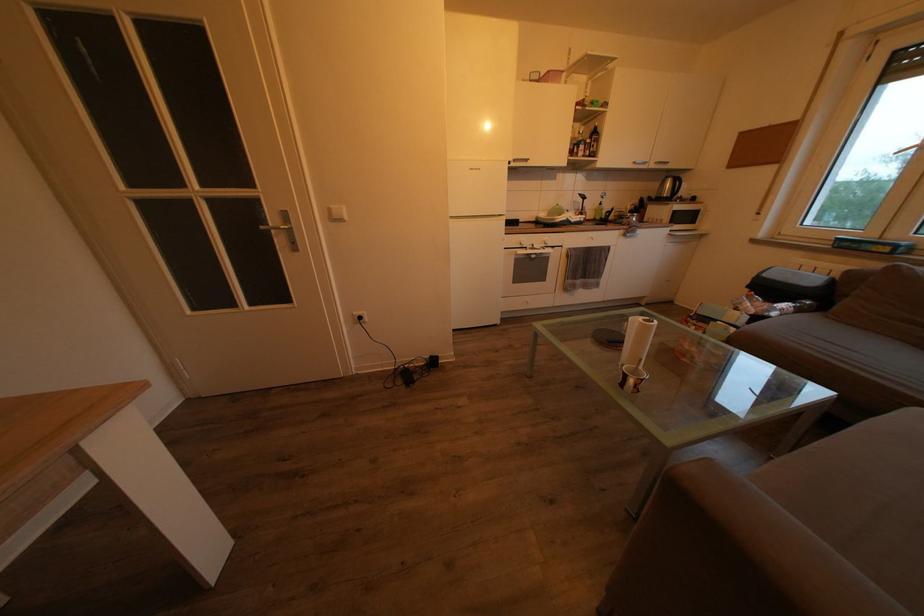
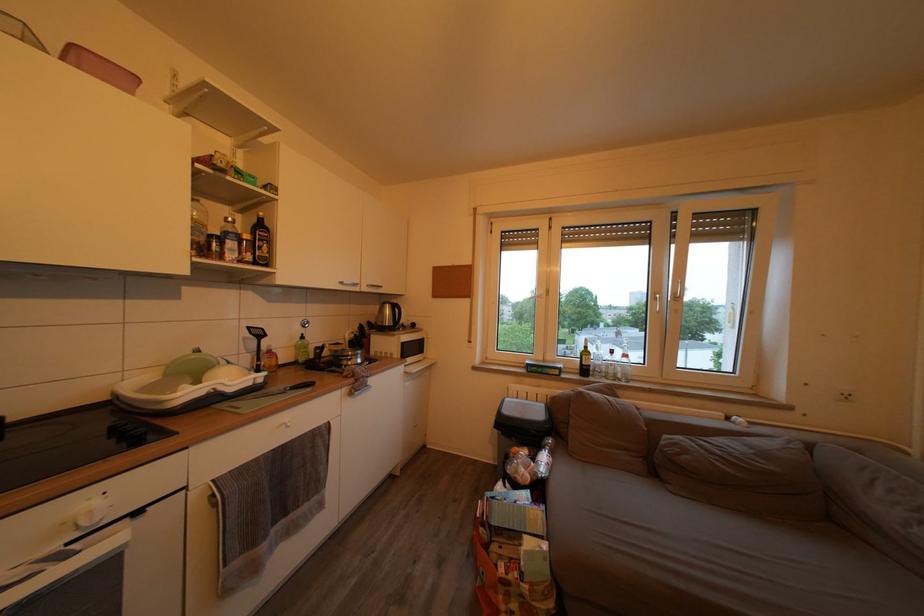
Where in the second image is the point corresponding to pixel 853 369 from the first image?

(685, 580)